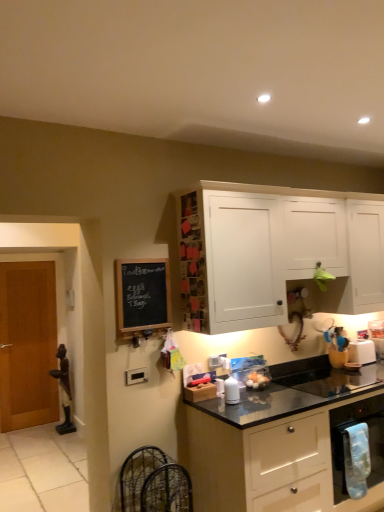
Question: Is black chalkboard at left turned away from black granite sink at lower right?

Choices:
 (A) yes
 (B) no

Answer: (B)

Question: From a real-world perspective, is black chalkboard at left located higher than black granite sink at lower right?

Choices:
 (A) no
 (B) yes

Answer: (B)

Question: Could black granite sink at lower right be considered to be inside black chalkboard at left?

Choices:
 (A) no
 (B) yes

Answer: (A)

Question: Does black chalkboard at left have a larger size compared to black granite sink at lower right?

Choices:
 (A) yes
 (B) no

Answer: (B)

Question: Is the position of black chalkboard at left more distant than that of black granite sink at lower right?

Choices:
 (A) no
 (B) yes

Answer: (A)

Question: Is white plastic toaster at right, which appears as the 2th appliance when viewed from the left, wider or thinner than wooden door at left?

Choices:
 (A) wide
 (B) thin

Answer: (A)

Question: From a real-world perspective, is white plastic toaster at right, which appears as the 1th appliance when viewed from the back, positioned above or below wooden door at left?

Choices:
 (A) above
 (B) below

Answer: (A)

Question: Based on their sizes in the image, would you say white plastic toaster at right, which appears as the 1th appliance when viewed from the back, is bigger or smaller than wooden door at left?

Choices:
 (A) small
 (B) big

Answer: (A)

Question: From the image's perspective, relative to wooden door at left, is white plastic toaster at right, which appears as the 1th appliance when viewed from the back, above or below?

Choices:
 (A) below
 (B) above

Answer: (B)

Question: Is wooden door at left to the left or to the right of black chalkboard at left in the image?

Choices:
 (A) left
 (B) right

Answer: (A)

Question: Is wooden door at left in front of or behind black chalkboard at left in the image?

Choices:
 (A) front
 (B) behind

Answer: (B)

Question: Is wooden door at left wider or thinner than black chalkboard at left?

Choices:
 (A) thin
 (B) wide

Answer: (B)

Question: From the image's perspective, is wooden door at left above or below black chalkboard at left?

Choices:
 (A) below
 (B) above

Answer: (A)

Question: From a real-world perspective, is blue fabric towel at lower right above or below white plastic toaster at right, which appears as the 2th appliance when viewed from the left?

Choices:
 (A) above
 (B) below

Answer: (B)

Question: Considering the positions of blue fabric towel at lower right and white plastic toaster at right, which appears as the 1th appliance when viewed from the back, in the image, is blue fabric towel at lower right bigger or smaller than white plastic toaster at right, which appears as the 1th appliance when viewed from the back,?

Choices:
 (A) small
 (B) big

Answer: (B)